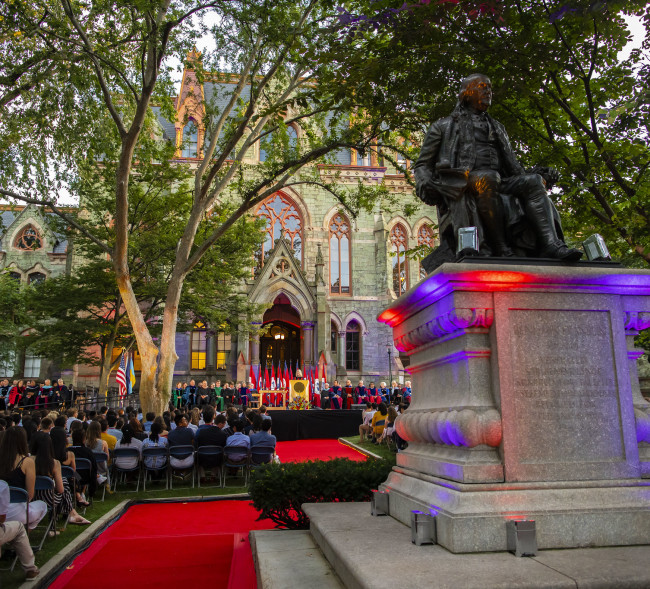
At what (x,y) coordinates should I click in order to perform the action: click on 1 statue. Please return your answer as a coordinate pair (x, y). Image resolution: width=650 pixels, height=589 pixels. Looking at the image, I should click on (x=509, y=201).